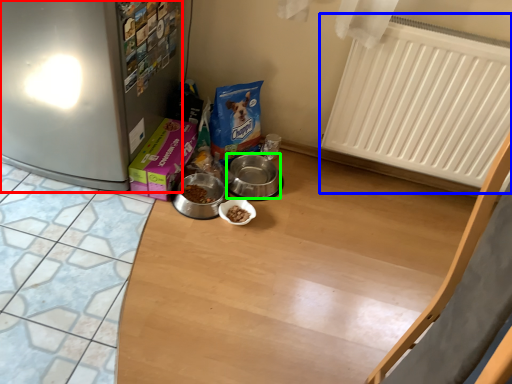
Question: Which object is positioned closest to fridge (highlighted by a red box)? Select from radiator (highlighted by a blue box) and appliance (highlighted by a green box).

Choices:
 (A) radiator
 (B) appliance

Answer: (B)